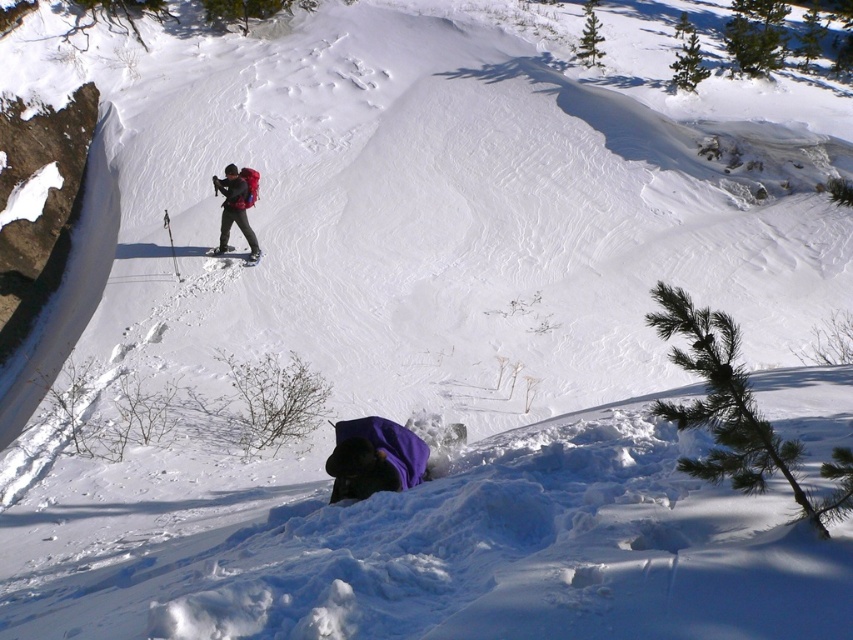
Question: Can you confirm if green needle-like pine at lower right is positioned below matte red backpack at center?

Choices:
 (A) yes
 (B) no

Answer: (A)

Question: Among these points, which one is nearest to the camera?

Choices:
 (A) (212, 256)
 (B) (820, 467)
 (C) (247, 198)

Answer: (B)

Question: Does green needle-like pine at lower right have a larger size compared to matte red backpack at center?

Choices:
 (A) yes
 (B) no

Answer: (A)

Question: Which of these objects is positioned closest to the matte black ski at center?

Choices:
 (A) matte red backpack at center
 (B) green needle-like pine at lower right

Answer: (A)

Question: Can you confirm if matte red backpack at center is bigger than matte black ski at center?

Choices:
 (A) yes
 (B) no

Answer: (A)

Question: Based on their relative distances, which object is nearer to the green needle-like pine at lower right?

Choices:
 (A) matte black ski at center
 (B) matte red backpack at center

Answer: (B)